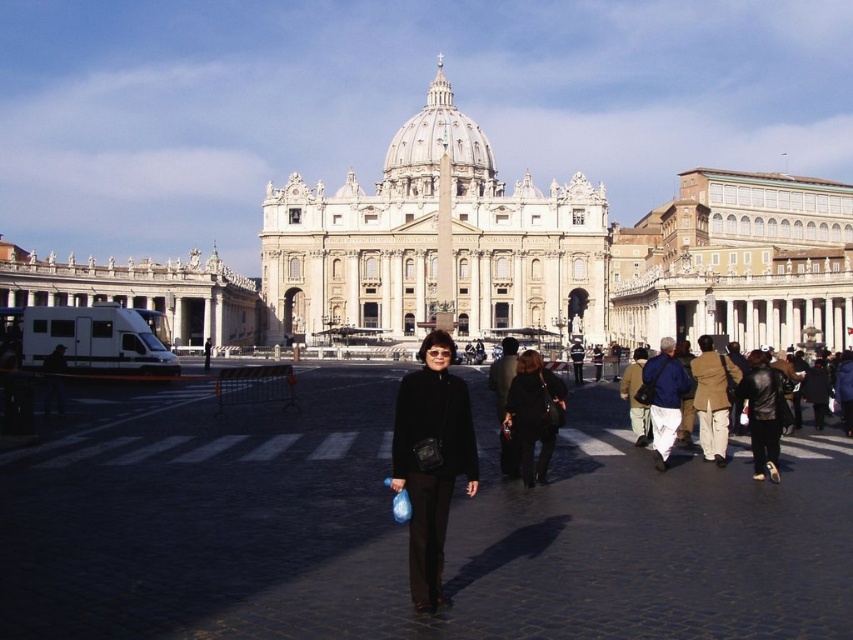
You are a tourist visiting St. Peter Square and you want to take a photo of the white marble palace at right and the black matte jacket at center. Which object will appear bigger in your photo?

The white marble palace at right will appear bigger in the photo because it is larger in size than the black matte jacket at center.

You are a tourist standing in St. Peter Square and want to take a photo of both the white marble cathedral at center and the white marble palace at left. Which one should you frame first in your camera viewfinder to ensure both are fully visible?

To ensure both the white marble cathedral at center and the white marble palace at left are fully visible in your photo, you should frame the white marble cathedral at center first because it might be wider than the white marble palace at left, so starting with the wider structure allows enough space for the palace.

You are a tourist standing in St. Peter Square. You see the black asphalt at center and the white marble palace at right. Which one is taller?

The white marble palace at right is taller than the black asphalt at center.